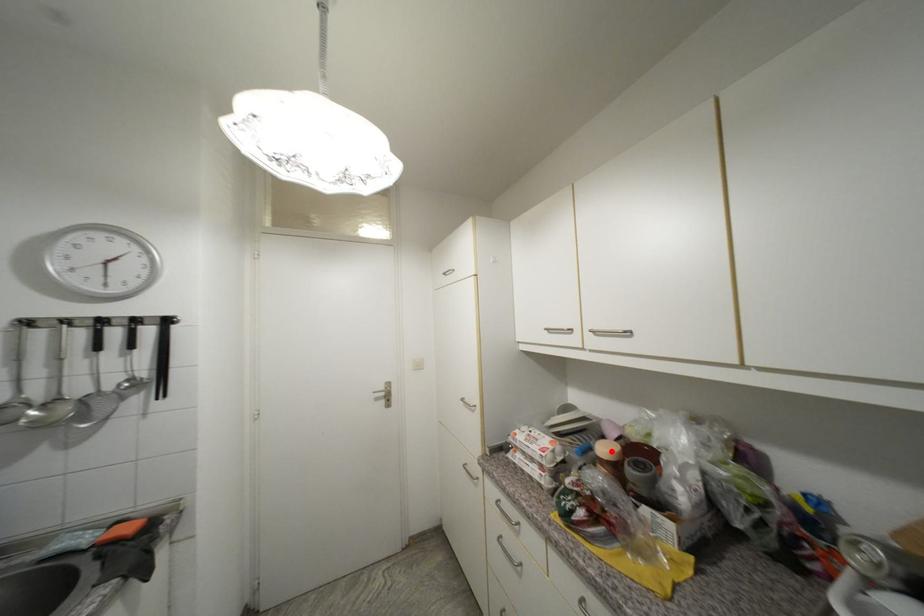
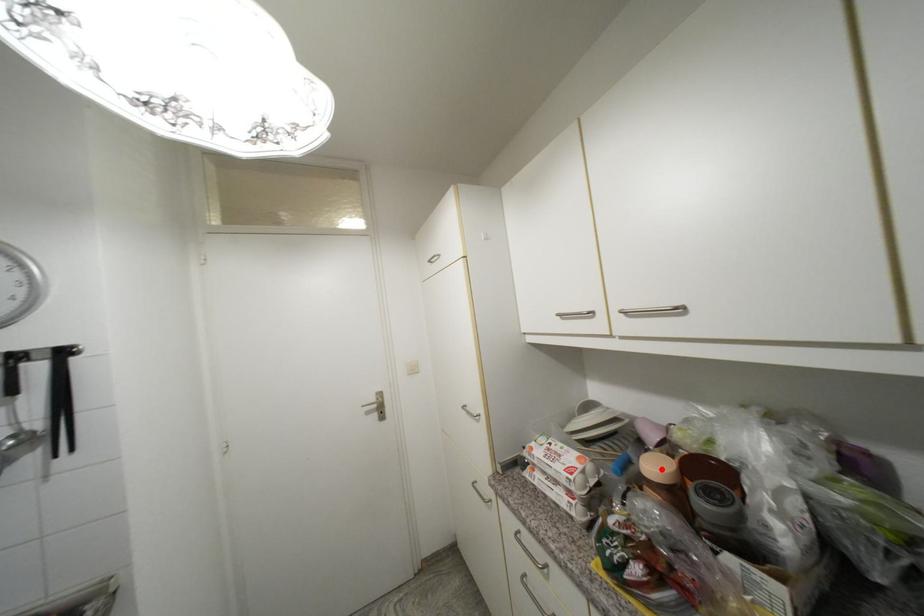
I am providing you with two images of the same scene from different viewpoints. A red point is marked on the first image and another point is marked on the second image. Is the marked point in image1 the same physical position as the marked point in image2?

Yes